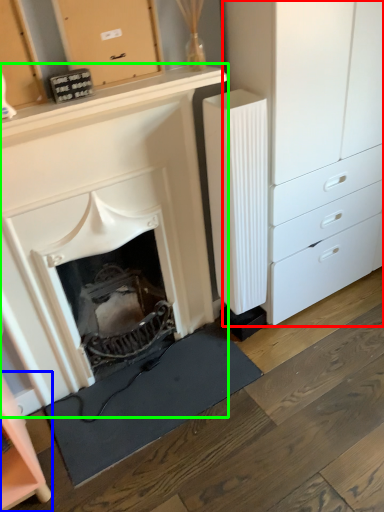
Question: Which object is the closest to the chest of drawers (highlighted by a red box)? Choose among these: cabinetry (highlighted by a blue box) or fireplace (highlighted by a green box).

Choices:
 (A) cabinetry
 (B) fireplace

Answer: (B)